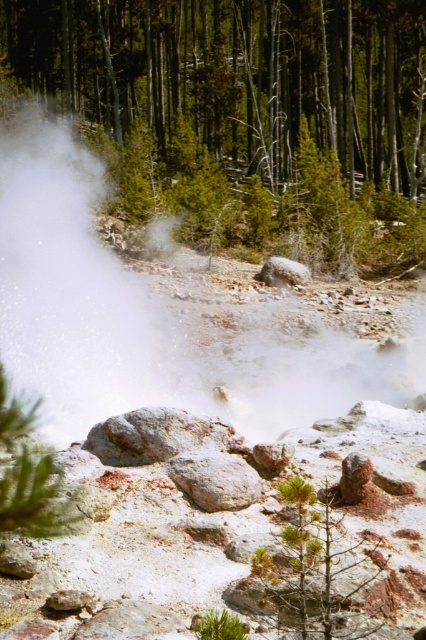
Is green matte tree at upper center closer to camera compared to white vapor at center?

No, it is not.

Does green matte tree at upper center have a larger size compared to white vapor at center?

Indeed, green matte tree at upper center has a larger size compared to white vapor at center.

What do you see at coordinates (244, 115) in the screenshot? I see `green matte tree at upper center` at bounding box center [244, 115].

The image size is (426, 640). I want to click on green matte tree at upper center, so click(244, 115).